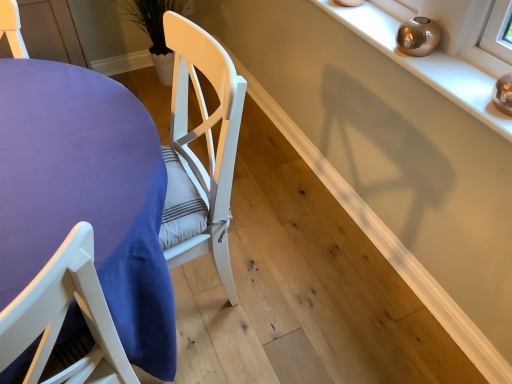
Question: Considering the relative sizes of metallic gold orb at upper right and purple fabric table at lower left in the image provided, is metallic gold orb at upper right shorter than purple fabric table at lower left?

Choices:
 (A) no
 (B) yes

Answer: (B)

Question: Considering the relative sizes of metallic gold orb at upper right and purple fabric table at lower left in the image provided, is metallic gold orb at upper right wider than purple fabric table at lower left?

Choices:
 (A) yes
 (B) no

Answer: (B)

Question: Is purple fabric table at lower left at the back of metallic gold orb at upper right?

Choices:
 (A) no
 (B) yes

Answer: (A)

Question: Could purple fabric table at lower left be considered to be inside metallic gold orb at upper right?

Choices:
 (A) yes
 (B) no

Answer: (B)

Question: Is metallic gold orb at upper right aimed at purple fabric table at lower left?

Choices:
 (A) yes
 (B) no

Answer: (B)

Question: Is metallic gold orb at upper right positioned beyond the bounds of purple fabric table at lower left?

Choices:
 (A) no
 (B) yes

Answer: (B)

Question: Does purple fabric table at lower left turn towards metallic gold orb at upper right?

Choices:
 (A) no
 (B) yes

Answer: (A)

Question: From a real-world perspective, is purple fabric table at lower left over metallic gold orb at upper right?

Choices:
 (A) no
 (B) yes

Answer: (A)

Question: Considering the relative positions of purple fabric table at lower left and metallic gold orb at upper right in the image provided, is purple fabric table at lower left behind metallic gold orb at upper right?

Choices:
 (A) yes
 (B) no

Answer: (B)

Question: From the image's perspective, would you say purple fabric table at lower left is shown under metallic gold orb at upper right?

Choices:
 (A) yes
 (B) no

Answer: (A)

Question: Does purple fabric table at lower left touch metallic gold orb at upper right?

Choices:
 (A) yes
 (B) no

Answer: (B)

Question: From a real-world perspective, does purple fabric table at lower left sit lower than metallic gold orb at upper right?

Choices:
 (A) no
 (B) yes

Answer: (B)

Question: In terms of height, does purple fabric table at lower left look taller or shorter compared to metallic gold orb at upper right?

Choices:
 (A) short
 (B) tall

Answer: (B)